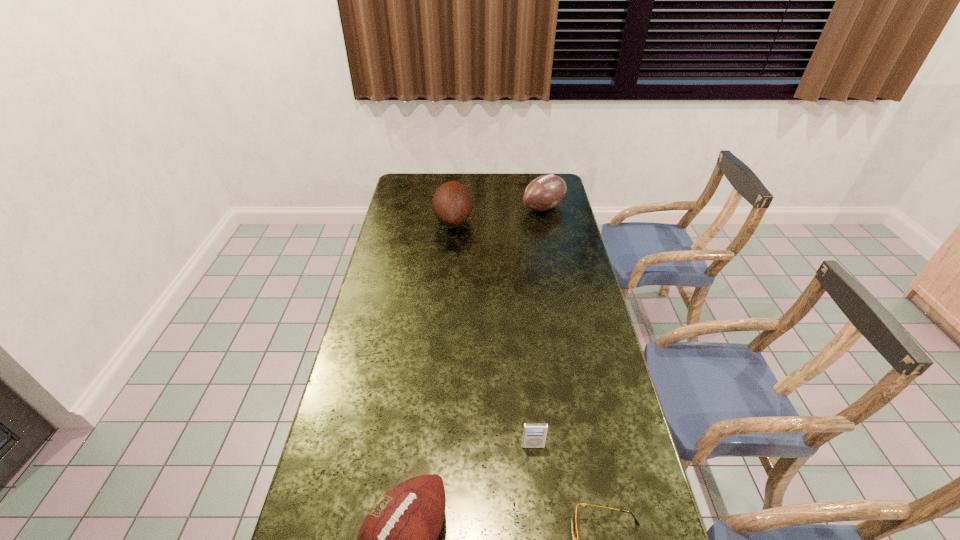
You are a GUI agent. You are given a task and a screenshot of the screen. Output one action in this format:
    pyautogui.click(x=<x>, y=<y>)
    Task: Click on the rightmost football (American)
    
    Given the screenshot: What is the action you would take?
    point(545,192)

This screenshot has height=540, width=960. Identify the location of the fourth tallest object. (534, 434).

The height and width of the screenshot is (540, 960). In order to click on iPod in this screenshot , I will do `click(534, 434)`.

Locate an element on the screen. The image size is (960, 540). free space located 0.180m on the front of the rightmost football (American) is located at coordinates (551, 244).

Identify the location of vacant space located on the front-facing side of the iPod. Image resolution: width=960 pixels, height=540 pixels. (537, 480).

At what (x,y) coordinates should I click in order to perform the action: click on object present at the far edge. Please return your answer as a coordinate pair (x, y). The height and width of the screenshot is (540, 960). Looking at the image, I should click on (545, 192).

This screenshot has height=540, width=960. I want to click on object situated at the right edge, so click(x=545, y=192).

Find the location of a particular element. The image size is (960, 540). object at the far right corner is located at coordinates (545, 192).

Identify the location of blank space at the far edge of the desktop. The height and width of the screenshot is (540, 960). (520, 175).

In the image, there is a desktop. At what (x,y) coordinates should I click in order to perform the action: click on vacant area at the left edge. Please return your answer as a coordinate pair (x, y). The height and width of the screenshot is (540, 960). Looking at the image, I should click on (350, 516).